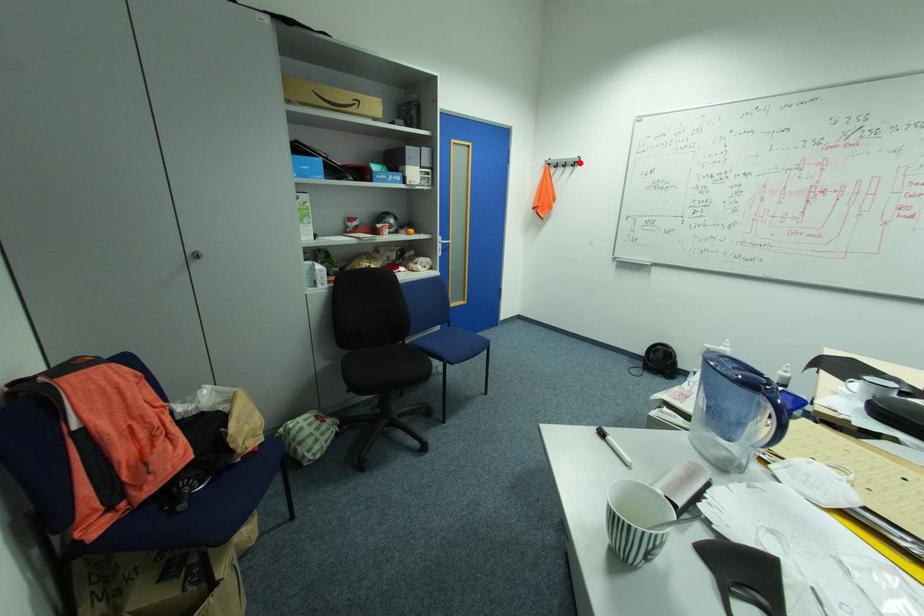
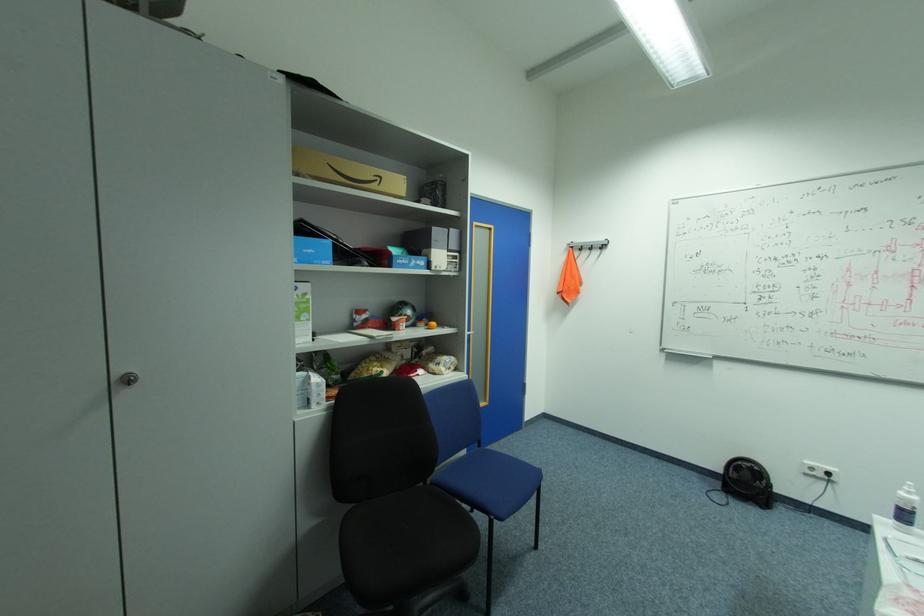
Where in the second image is the point corresponding to the highlighted location from the first image?

(608, 246)